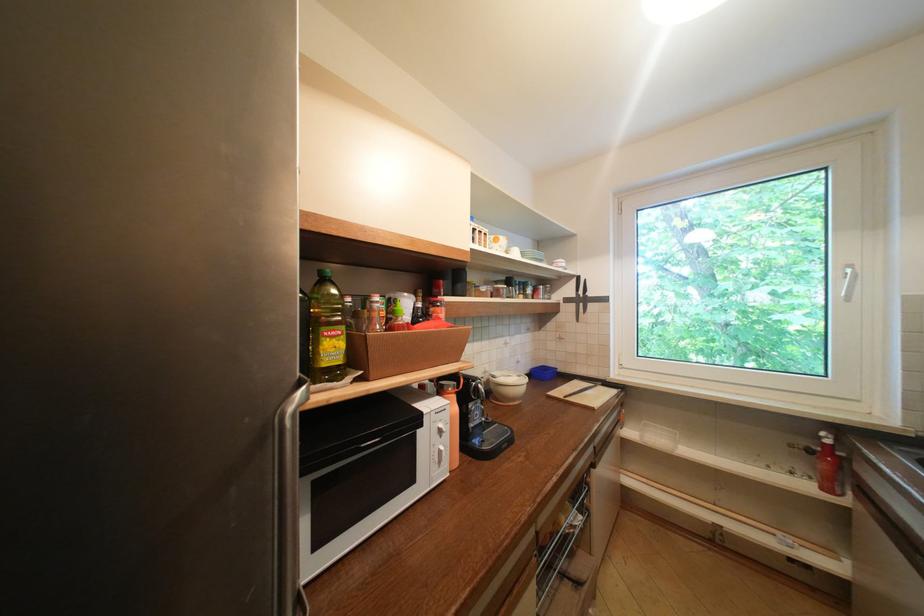
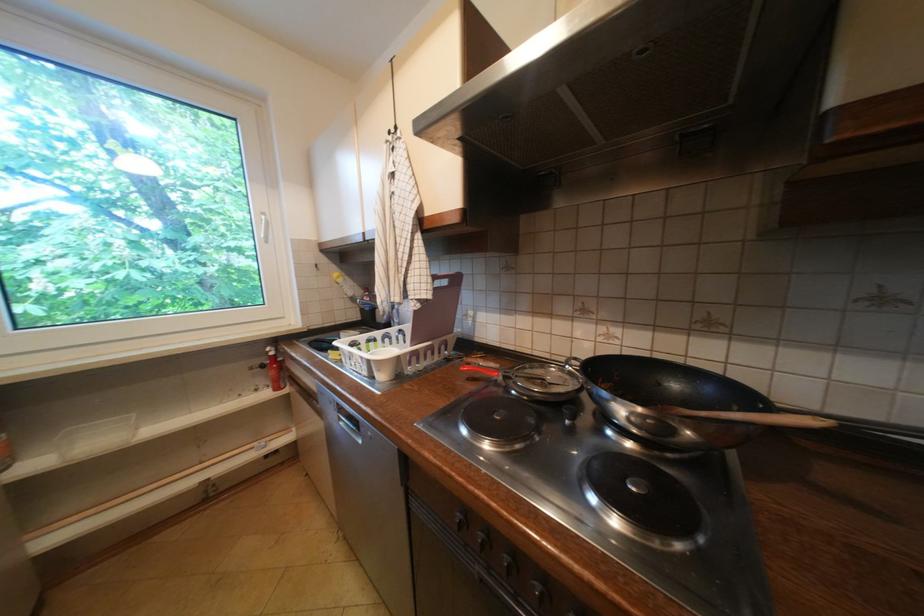
Question: The camera is either moving clockwise (left) or counter-clockwise (right) around the object. The first image is from the beginning of the video and the second image is from the end. Is the camera moving left or right when shooting the video?

Choices:
 (A) Left
 (B) Right

Answer: (A)